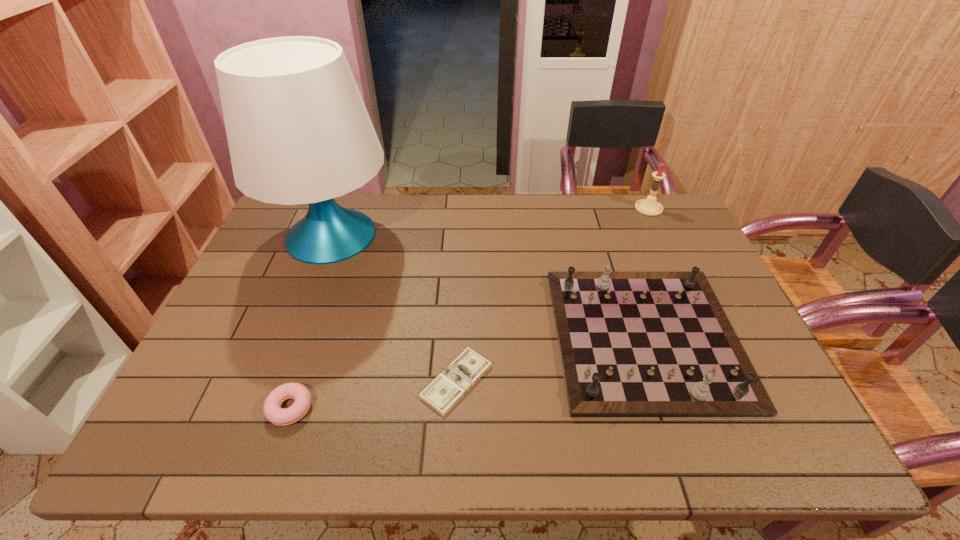
The height and width of the screenshot is (540, 960). Identify the location of table lamp. (298, 131).

Locate an element on the screen. The width and height of the screenshot is (960, 540). candle is located at coordinates (650, 207).

This screenshot has width=960, height=540. I want to click on chessboard, so click(x=632, y=344).

This screenshot has width=960, height=540. What are the coordinates of `the fourth tallest object` in the screenshot? It's located at (273, 412).

The width and height of the screenshot is (960, 540). What are the coordinates of `the shortest object` in the screenshot? It's located at (444, 391).

This screenshot has height=540, width=960. Identify the location of dollar. (444, 391).

The width and height of the screenshot is (960, 540). Find the location of `free space located on the front-facing side of the table lamp`. free space located on the front-facing side of the table lamp is located at coordinates (422, 235).

Where is `free space located 0.240m on the front of the fourth shortest object`? Image resolution: width=960 pixels, height=540 pixels. free space located 0.240m on the front of the fourth shortest object is located at coordinates (675, 263).

Identify the location of vacant point located on the back of the doughnut. (304, 367).

The width and height of the screenshot is (960, 540). I want to click on vacant space located 0.120m on the left of the shortest object, so pyautogui.click(x=371, y=381).